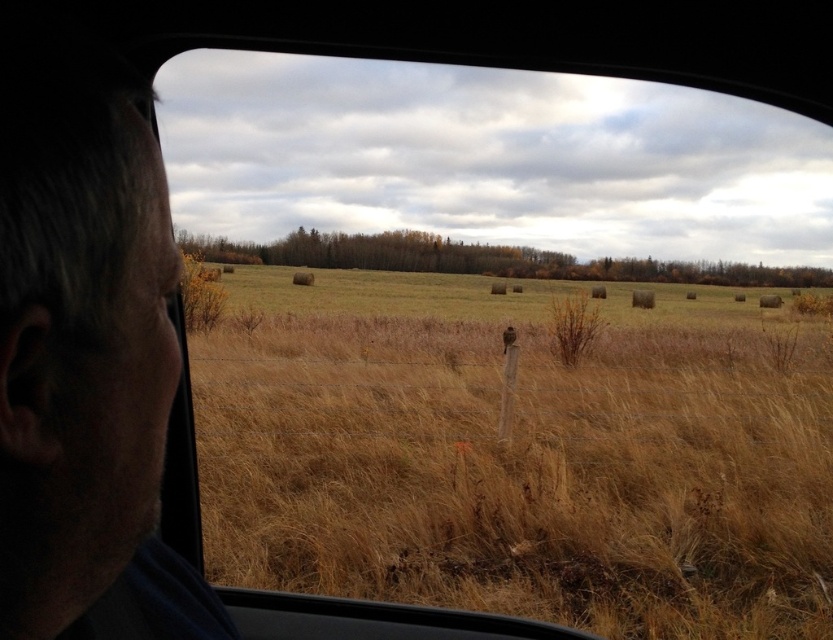
Question: Among these objects, which one is farthest from the camera?

Choices:
 (A) dry grass at center
 (B) gray hair at left

Answer: (A)

Question: Where is dry grass at center located in relation to gray hair at left in the image?

Choices:
 (A) left
 (B) right

Answer: (B)

Question: Where is dry grass at center located in relation to gray hair at left in the image?

Choices:
 (A) above
 (B) below

Answer: (A)

Question: Which point is farther to the camera?

Choices:
 (A) (611, 298)
 (B) (1, 310)

Answer: (A)

Question: Is the position of dry grass at center more distant than that of gray hair at left?

Choices:
 (A) yes
 (B) no

Answer: (A)